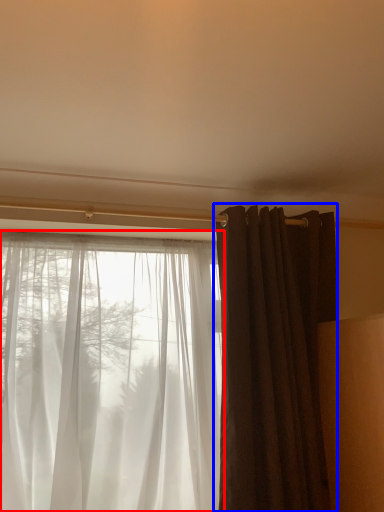
Question: Which of the following is the closest to the observer, curtain (highlighted by a red box) or curtain (highlighted by a blue box)?

Choices:
 (A) curtain
 (B) curtain

Answer: (A)